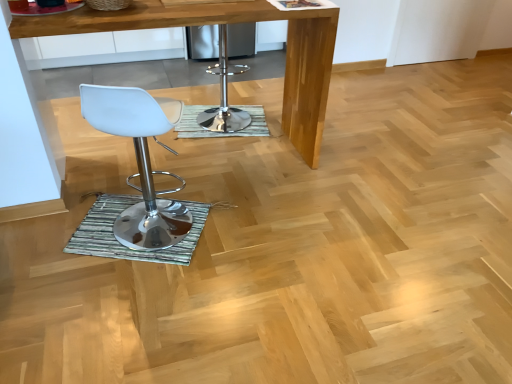
Image resolution: width=512 pixels, height=384 pixels. What are the coordinates of `empty space that is ontop of green textured mat at center, the 2th mat positioned from the top (from a real-world perspective)` in the screenshot? It's located at (130, 230).